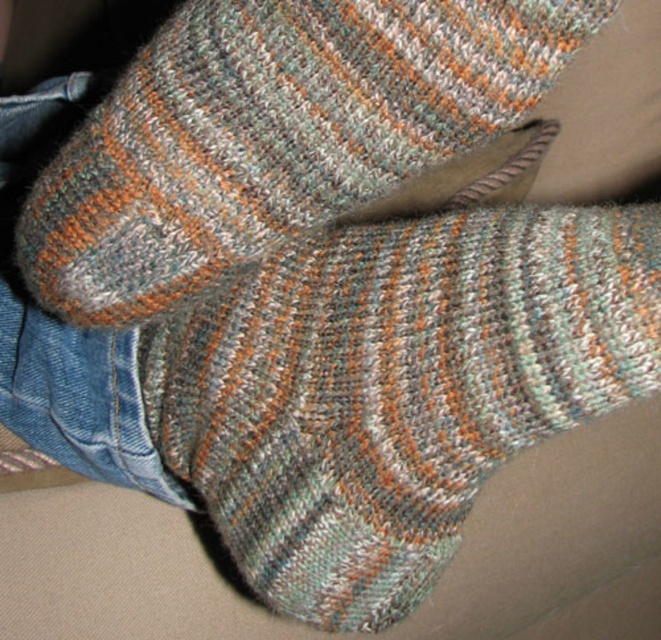
Can you confirm if multicolored knitted sock at lower center is positioned to the left of multicolored knitted sock at center?

Incorrect, multicolored knitted sock at lower center is not on the left side of multicolored knitted sock at center.

Is multicolored knitted sock at lower center below multicolored knitted sock at center?

Correct, multicolored knitted sock at lower center is located below multicolored knitted sock at center.

Between point (297, 486) and point (330, 28), which one is positioned in front?

Point (330, 28)

Find the location of a particular element. multicolored knitted sock at lower center is located at coordinates (393, 387).